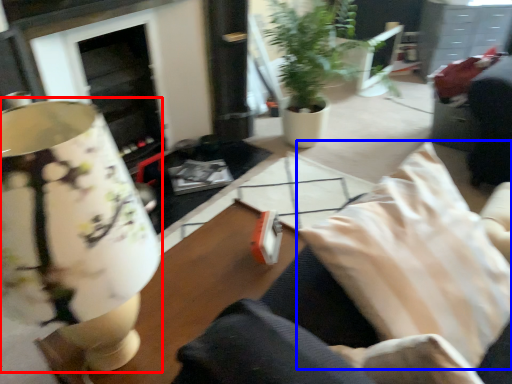
Question: Which of the following is the closest to the observer, table lamp (highlighted by a red box) or pillow (highlighted by a blue box)?

Choices:
 (A) table lamp
 (B) pillow

Answer: (A)